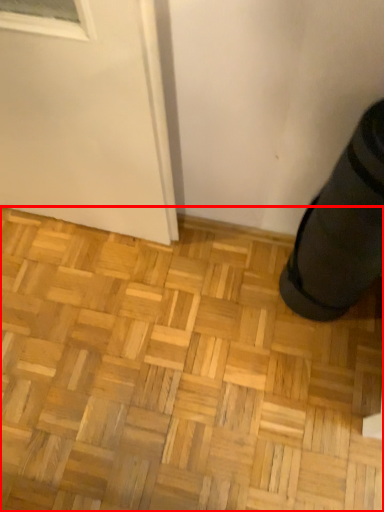
Question: From the image's perspective, what is the correct spatial positioning of hardwood (annotated by the red box) in reference to shoe?

Choices:
 (A) above
 (B) below

Answer: (B)